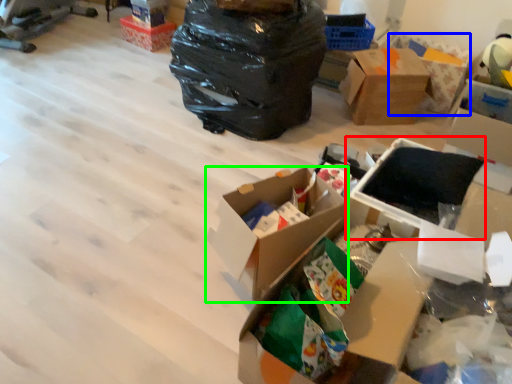
Question: Estimate the real-world distances between objects in this image. Which object is closer to storage box (highlighted by a red box), cardboard box (highlighted by a blue box) or box (highlighted by a green box)?

Choices:
 (A) cardboard box
 (B) box

Answer: (B)